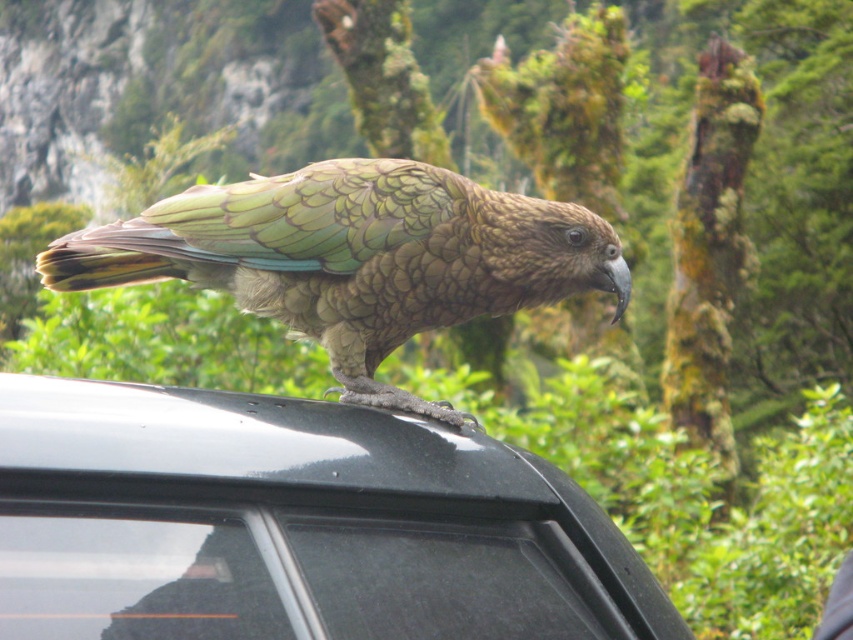
Question: Which of the following is the closest to the observer?

Choices:
 (A) (244, 406)
 (B) (462, 180)

Answer: (A)

Question: Which point is closer to the camera?

Choices:
 (A) (115, 486)
 (B) (74, 243)

Answer: (A)

Question: Is the position of glossy black car at top more distant than that of green scaly parrot at center?

Choices:
 (A) yes
 (B) no

Answer: (B)

Question: Is glossy black car at top wider than green scaly parrot at center?

Choices:
 (A) no
 (B) yes

Answer: (A)

Question: Which point is closer to the camera?

Choices:
 (A) glossy black car at top
 (B) green scaly parrot at center

Answer: (A)

Question: Is glossy black car at top bigger than green scaly parrot at center?

Choices:
 (A) no
 (B) yes

Answer: (B)